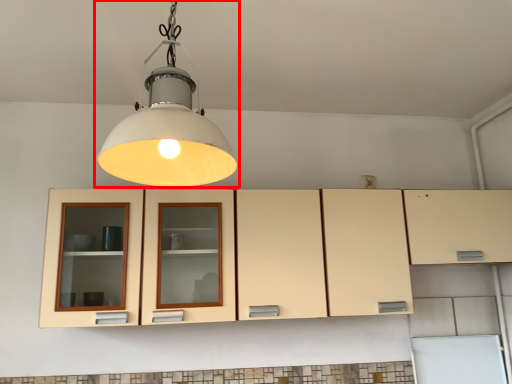
Question: Observing the image, what is the correct spatial positioning of lamp (annotated by the red box) in reference to cabinetry?

Choices:
 (A) right
 (B) left

Answer: (B)